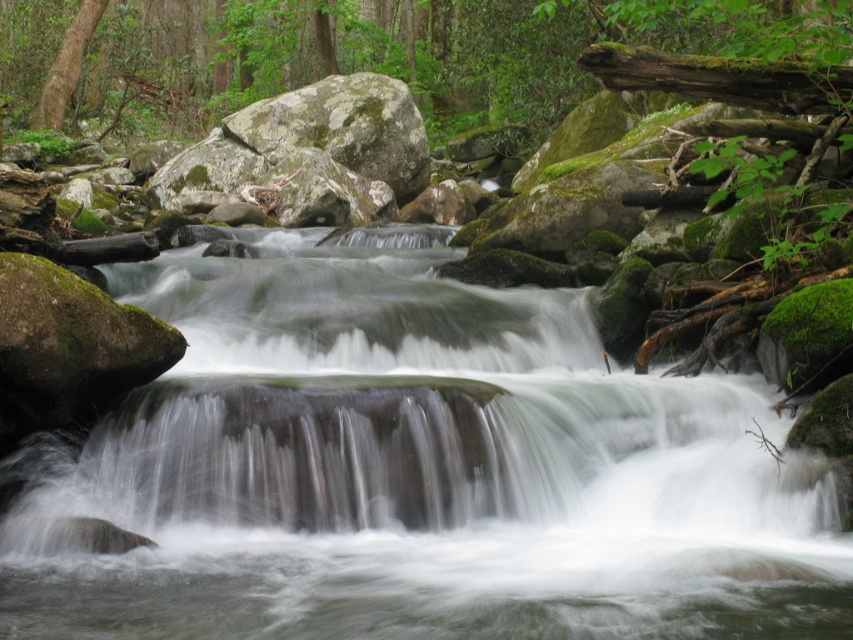
You are a hiker who wants to cross the stream using the rocks. The clear water at center and the green mossy rock at upper center are in your path. Which object is larger and can provide a safer stepping stone?

The green mossy rock at upper center is larger than the clear water at center, so it can provide a safer stepping stone for crossing the stream.

You are standing at the edge of the forest stream and see the clear water at center and the green mossy rock at upper center. Which object is nearer to you?

The clear water at center is closer to the viewer than the green mossy rock at upper center.